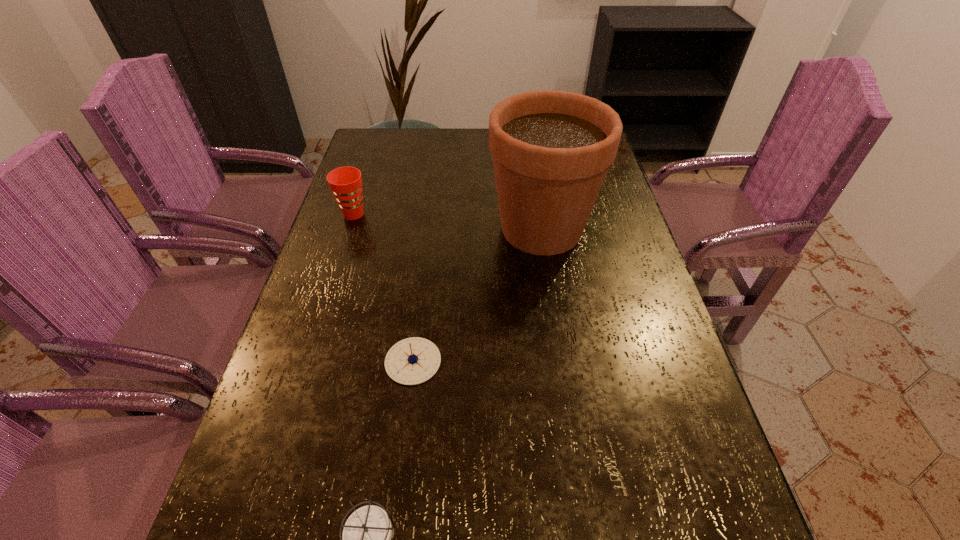
The height and width of the screenshot is (540, 960). Find the location of `flowerpot`. flowerpot is located at coordinates (551, 150).

Find the location of `the tallest object`. the tallest object is located at coordinates (551, 150).

This screenshot has width=960, height=540. What are the coordinates of `the second tallest object` in the screenshot? It's located at (345, 182).

The image size is (960, 540). What are the coordinates of `the leftmost object` in the screenshot? It's located at (345, 182).

The height and width of the screenshot is (540, 960). Find the location of `the second nearest object`. the second nearest object is located at coordinates (411, 361).

Locate an element on the screen. vacant area located on the front of the rightmost object is located at coordinates (550, 284).

The width and height of the screenshot is (960, 540). I want to click on free space located on the front of the cup, so click(x=331, y=285).

Where is `vacant space positioned on the back of the third farthest object`? The width and height of the screenshot is (960, 540). vacant space positioned on the back of the third farthest object is located at coordinates (424, 273).

You are a GUI agent. You are given a task and a screenshot of the screen. Output one action in this format:
    pyautogui.click(x=<x>, y=<y>)
    Task: Click on the object that is at the left edge
    
    Given the screenshot: What is the action you would take?
    [x=345, y=182]

Find the location of a particular element. The image size is (960, 540). object located at the right edge is located at coordinates (551, 150).